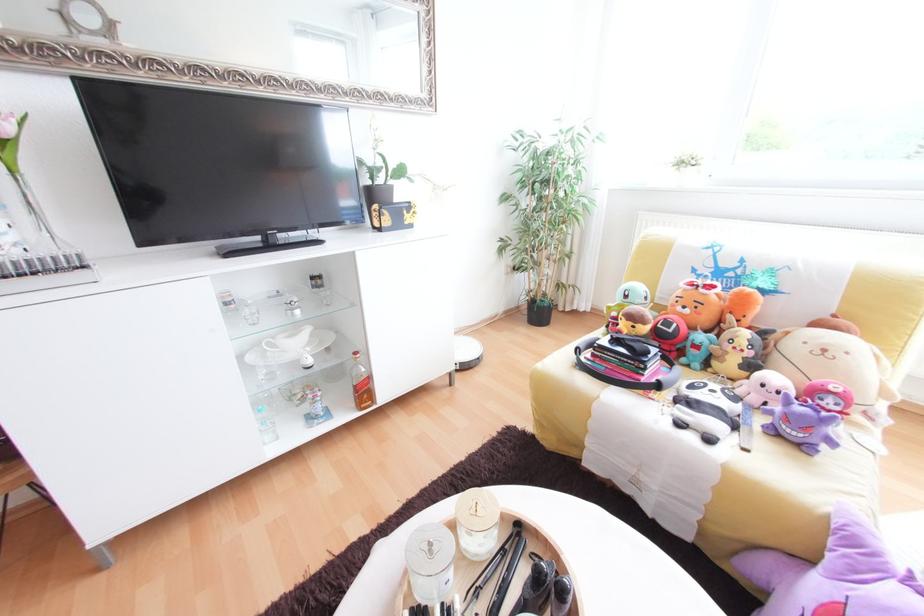
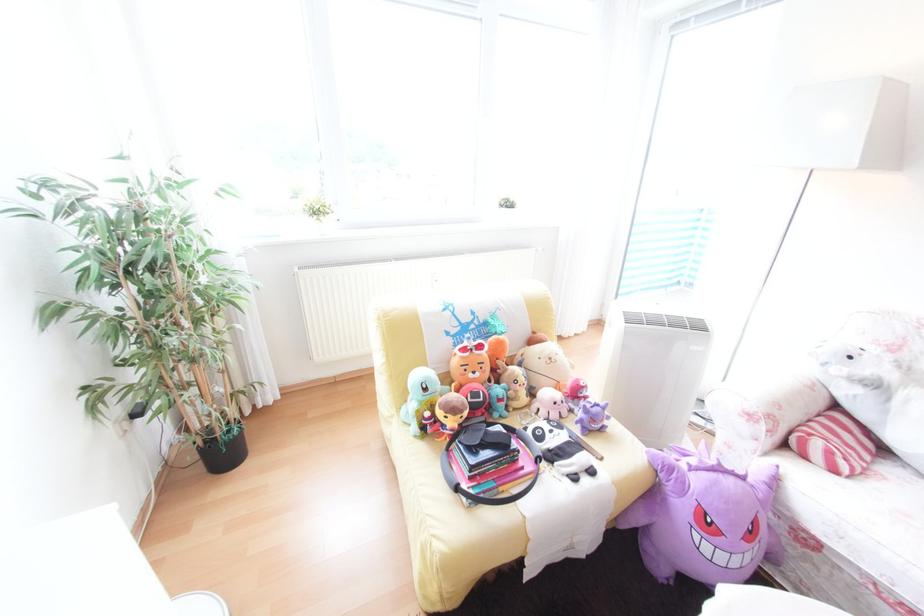
Where in the second image is the point corresponding to [743,400] from the first image?

(568, 427)